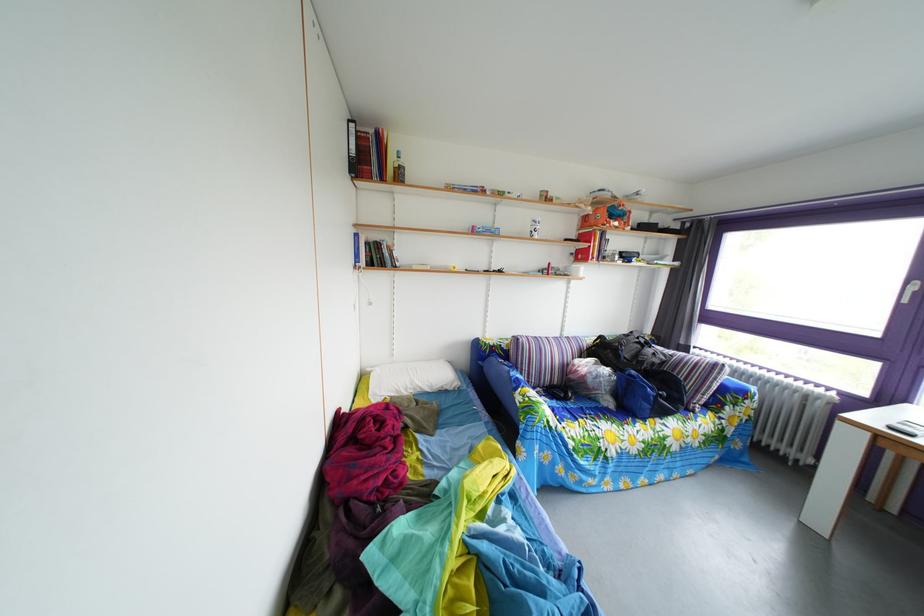
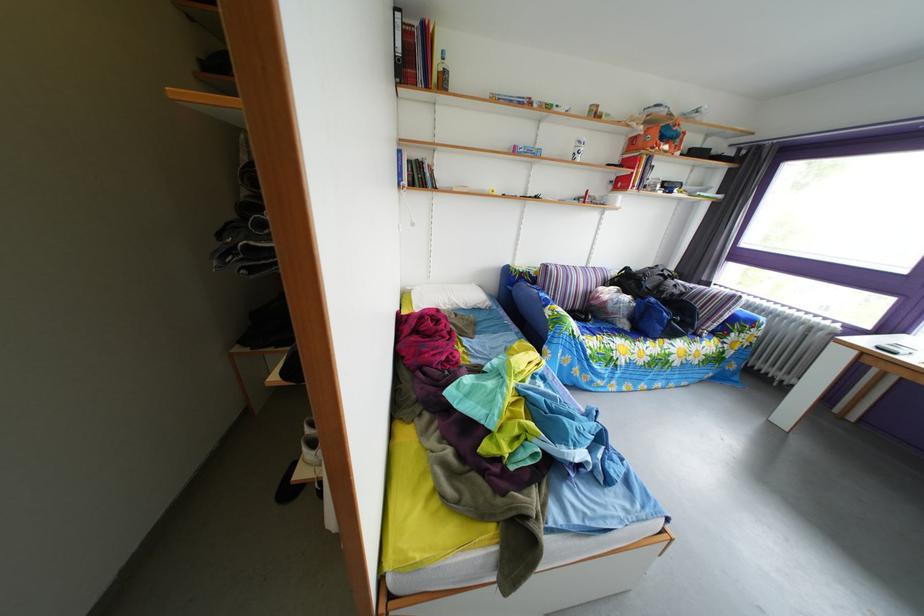
Find the pixel in the second image that matches (x=614, y=359) in the first image.

(638, 289)